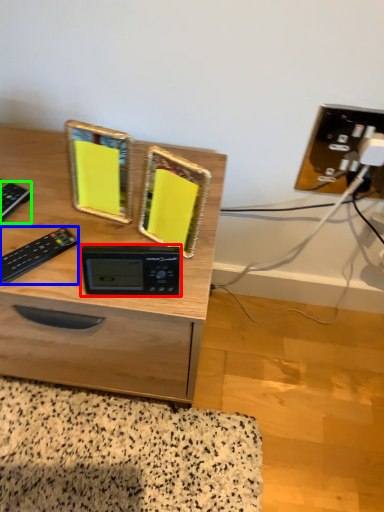
Question: Estimate the real-world distances between objects in this image. Which object is farther from appliance (highlighted by a red box), control (highlighted by a blue box) or control (highlighted by a green box)?

Choices:
 (A) control
 (B) control

Answer: (B)